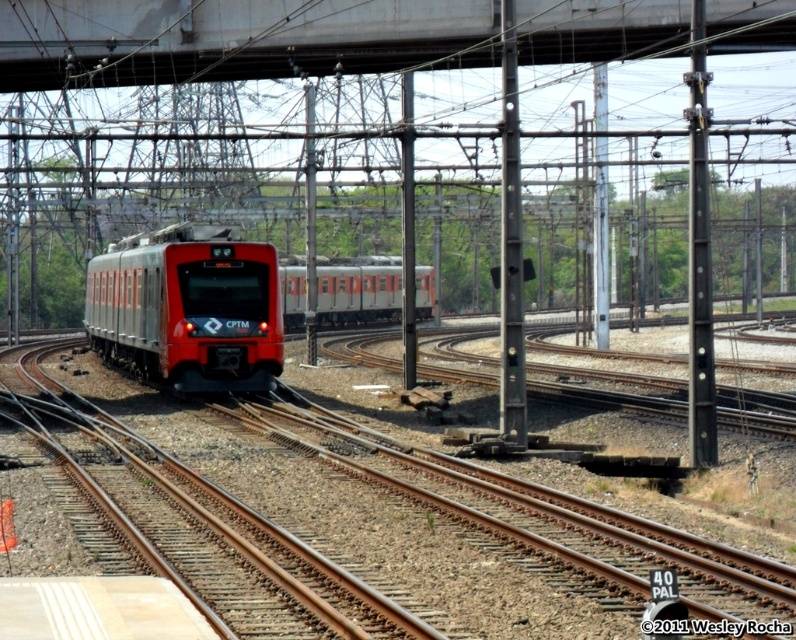
You are a railway engineer standing at the camera position. You need to inspect the metal at upper center. Can you safely reach it without any equipment?

The metal at upper center is 20.01 meters away from camera, so you cannot safely reach it without any equipment.

You are a railway engineer inspecting the overhead catenary system. You notice a metal object at point (x=235, y=38). Based on the image, can you identify what this metal object is part of?

The metal object at point (x=235, y=38) is part of the overhead catenary system described in the scene.

You are a maintenance worker inspecting the railway. You notice two metal structures in your viewfinder. One is the metal train tracks at center, and the other is the metal at upper center. Which of these two metal structures is taller?

The metal at upper center is taller than the metal train tracks at center.